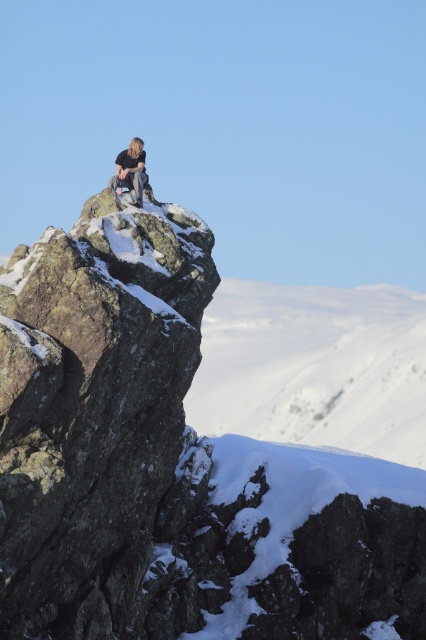
Can you confirm if rocky cliff at upper center is thinner than light brown hair at upper center?

In fact, rocky cliff at upper center might be wider than light brown hair at upper center.

Which is in front, point (129, 416) or point (111, 186)?

Point (129, 416) is in front.

What are the coordinates of `rocky cliff at upper center` in the screenshot? It's located at (172, 465).